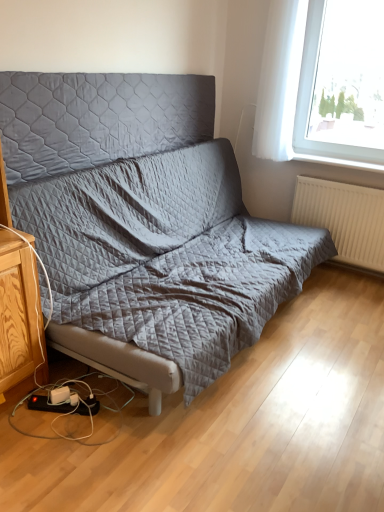
The height and width of the screenshot is (512, 384). Identify the location of vacant space in front of black plastic power strip at lower left. (56, 437).